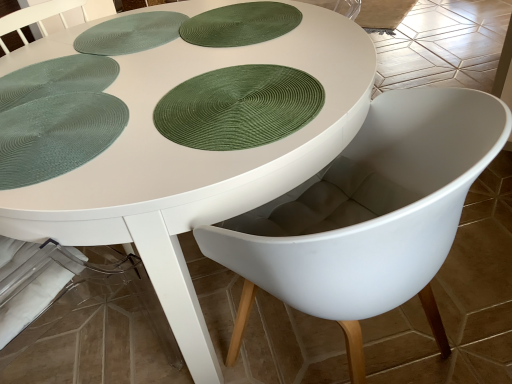
I want to click on free space that is in between green textured placemat at upper left, which appears as the 3th paper plate when ordered from the bottom, and green woven placemat at center, which is counted as the second paper plate, starting from the bottom, so click(x=145, y=96).